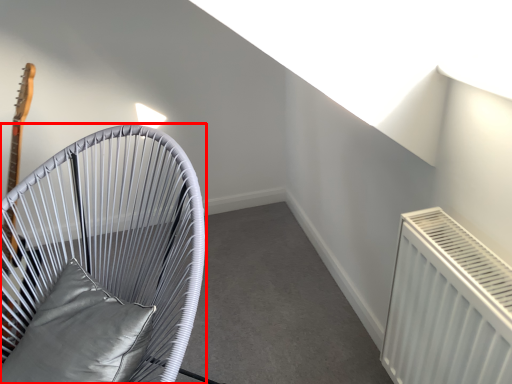
Question: From the image's perspective, considering the relative positions of furniture (annotated by the red box) and pillow in the image provided, where is furniture (annotated by the red box) located with respect to the staircase?

Choices:
 (A) below
 (B) above

Answer: (B)